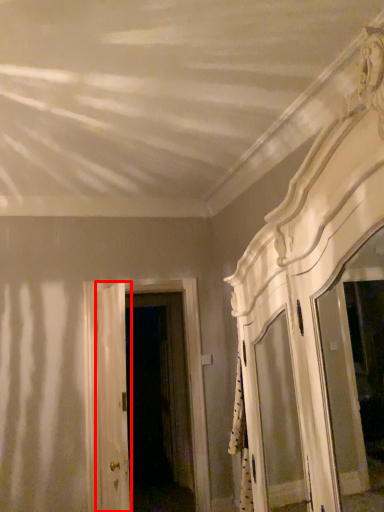
Question: From the image's perspective, where is door (annotated by the red box) located in relation to door in the image?

Choices:
 (A) below
 (B) above

Answer: (B)